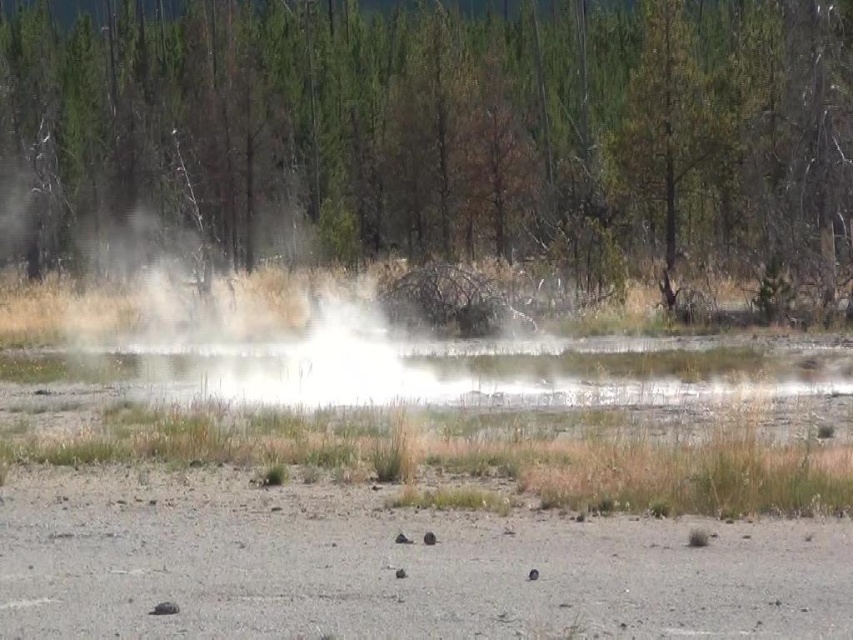
Question: Among these objects, which one is nearest to the camera?

Choices:
 (A) white steam at center
 (B) green textured tree at center

Answer: (A)

Question: Does green textured tree at center appear on the left side of white steam at center?

Choices:
 (A) yes
 (B) no

Answer: (A)

Question: Among these points, which one is nearest to the camera?

Choices:
 (A) (94, 365)
 (B) (798, 236)

Answer: (A)

Question: Is green textured tree at center thinner than white steam at center?

Choices:
 (A) yes
 (B) no

Answer: (B)

Question: Is green textured tree at center to the left of white steam at center from the viewer's perspective?

Choices:
 (A) yes
 (B) no

Answer: (A)